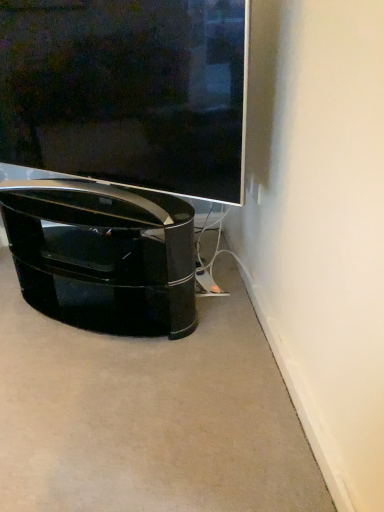
This screenshot has width=384, height=512. I want to click on vacant location below matte black tv at center (from a real-world perspective), so tap(90, 197).